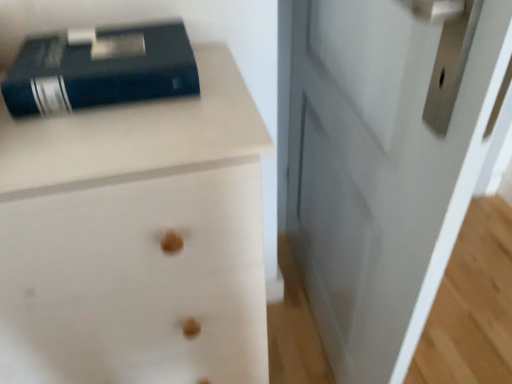
Identify the location of white wood chest of drawers at upper left. This screenshot has height=384, width=512. (135, 239).

The image size is (512, 384). What do you see at coordinates (135, 239) in the screenshot?
I see `white wood chest of drawers at upper left` at bounding box center [135, 239].

What do you see at coordinates (100, 69) in the screenshot? This screenshot has height=384, width=512. I see `matte black book at upper left` at bounding box center [100, 69].

The image size is (512, 384). In order to click on white glossy door at center in this screenshot , I will do `click(385, 162)`.

In order to click on chest of drawers on the left of white glossy door at center in this screenshot , I will do `click(135, 239)`.

Between white wood chest of drawers at upper left and white glossy door at center, which one has smaller width?

white glossy door at center is thinner.

Between white wood chest of drawers at upper left and white glossy door at center, which one is positioned in front?

white glossy door at center is more forward.

From the image's perspective, relative to white glossy door at center, is matte black book at upper left above or below?

matte black book at upper left is situated higher than white glossy door at center in the image.

How distant is matte black book at upper left from white glossy door at center?

19.99 inches.

Relative to white glossy door at center, is matte black book at upper left in front or behind?

Visually, matte black book at upper left is located behind white glossy door at center.

Is matte black book at upper left positioned beyond the bounds of white glossy door at center?

Yes.

Considering the positions of objects white glossy door at center and matte black book at upper left in the image provided, who is behind, white glossy door at center or matte black book at upper left?

Positioned behind is matte black book at upper left.

How many degrees apart are the facing directions of white glossy door at center and matte black book at upper left?

There is a 79.9-degree angle between the facing directions of white glossy door at center and matte black book at upper left.

Is white glossy door at center to the left or to the right of matte black book at upper left in the image?

In the image, white glossy door at center appears on the right side of matte black book at upper left.

Where is `paperback book above the white glossy door at center (from a real-world perspective)`? This screenshot has width=512, height=384. paperback book above the white glossy door at center (from a real-world perspective) is located at coordinates (100, 69).

Is matte black book at upper left inside or outside of white wood chest of drawers at upper left?

matte black book at upper left is spatially situated outside white wood chest of drawers at upper left.

How many degrees apart are the facing directions of matte black book at upper left and white wood chest of drawers at upper left?

0.00076 degrees.

Is point (126, 70) more distant than point (44, 175)?

That is True.

Where is `paperback book that appears above the white wood chest of drawers at upper left (from a real-world perspective)`? The height and width of the screenshot is (384, 512). paperback book that appears above the white wood chest of drawers at upper left (from a real-world perspective) is located at coordinates (100, 69).

From a real-world perspective, which object rests below the other?

white wood chest of drawers at upper left.

Is white glossy door at center in contact with white wood chest of drawers at upper left?

No, white glossy door at center is not touching white wood chest of drawers at upper left.

Find the location of `door above the white wood chest of drawers at upper left (from the image's perspective)`. door above the white wood chest of drawers at upper left (from the image's perspective) is located at coordinates (385, 162).

Does white glossy door at center turn towards white wood chest of drawers at upper left?

Yes, white glossy door at center is turned towards white wood chest of drawers at upper left.

Between white wood chest of drawers at upper left and matte black book at upper left, which one appears on the right side from the viewer's perspective?

Positioned to the right is matte black book at upper left.

From their relative heights in the image, would you say white wood chest of drawers at upper left is taller or shorter than matte black book at upper left?

Considering their sizes, white wood chest of drawers at upper left has more height than matte black book at upper left.

From the image's perspective, is white wood chest of drawers at upper left over matte black book at upper left?

No.

Is white wood chest of drawers at upper left positioned with its back to matte black book at upper left?

white wood chest of drawers at upper left is not turned away from matte black book at upper left.

Where is `the chest of drawers beneath the white glossy door at center (from a real-world perspective)`? the chest of drawers beneath the white glossy door at center (from a real-world perspective) is located at coordinates point(135,239).

Locate an element on the screen. This screenshot has width=512, height=384. paperback book above the white glossy door at center (from a real-world perspective) is located at coordinates (100, 69).

When comparing their distances from white glossy door at center, does matte black book at upper left or white wood chest of drawers at upper left seem further?

Among the two, matte black book at upper left is located further to white glossy door at center.

When comparing their distances from matte black book at upper left, does white wood chest of drawers at upper left or white glossy door at center seem further?

The object further to matte black book at upper left is white glossy door at center.

Consider the image. Estimate the real-world distances between objects in this image. Which object is further from white wood chest of drawers at upper left, matte black book at upper left or white glossy door at center?

Among the two, white glossy door at center is located further to white wood chest of drawers at upper left.

Which object lies nearer to the anchor point white glossy door at center, white wood chest of drawers at upper left or matte black book at upper left?

Based on the image, white wood chest of drawers at upper left appears to be nearer to white glossy door at center.

Based on their spatial positions, is white glossy door at center or white wood chest of drawers at upper left closer to matte black book at upper left?

white wood chest of drawers at upper left lies closer to matte black book at upper left than the other object.

Which object lies nearer to the anchor point white wood chest of drawers at upper left, white glossy door at center or matte black book at upper left?

matte black book at upper left is closer to white wood chest of drawers at upper left.

Where is `paperback book situated between white wood chest of drawers at upper left and white glossy door at center from left to right`? paperback book situated between white wood chest of drawers at upper left and white glossy door at center from left to right is located at coordinates (100, 69).